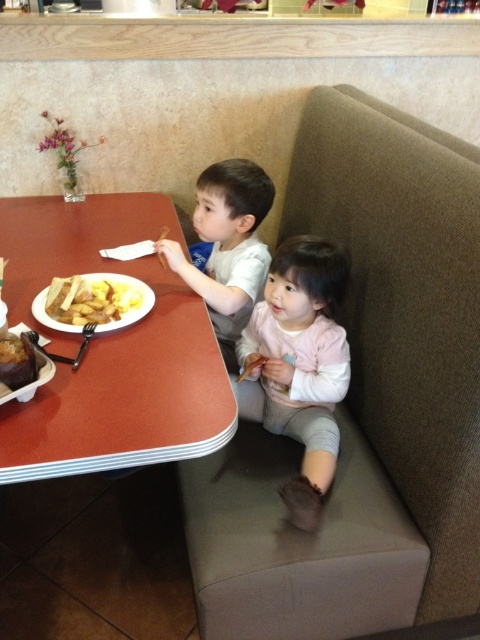
Does point (43, 284) lie in front of point (227, 285)?

Yes, it is in front of point (227, 285).

Is smooth red table at center thinner than light pink fabric children at lower center?

In fact, smooth red table at center might be wider than light pink fabric children at lower center.

Locate an element on the screen. This screenshot has width=480, height=640. smooth red table at center is located at coordinates (110, 348).

Based on the photo, between smooth red table at center and pale pink fleece at lower center, which one has less height?

With less height is pale pink fleece at lower center.

Does point (163, 426) come farther from viewer compared to point (260, 301)?

No, it is not.

The width and height of the screenshot is (480, 640). I want to click on smooth red table at center, so click(110, 348).

Can you confirm if smooth red table at center is thinner than matte white shirt at upper center?

No.

Who is positioned more to the right, smooth red table at center or matte white shirt at upper center?

Positioned to the right is matte white shirt at upper center.

Find the location of a particular element. The width and height of the screenshot is (480, 640). smooth red table at center is located at coordinates (110, 348).